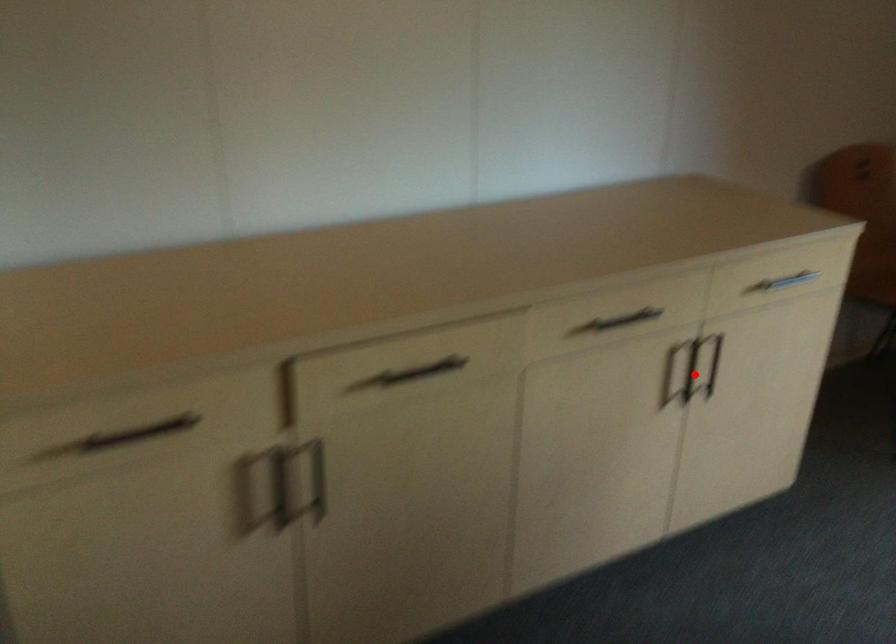
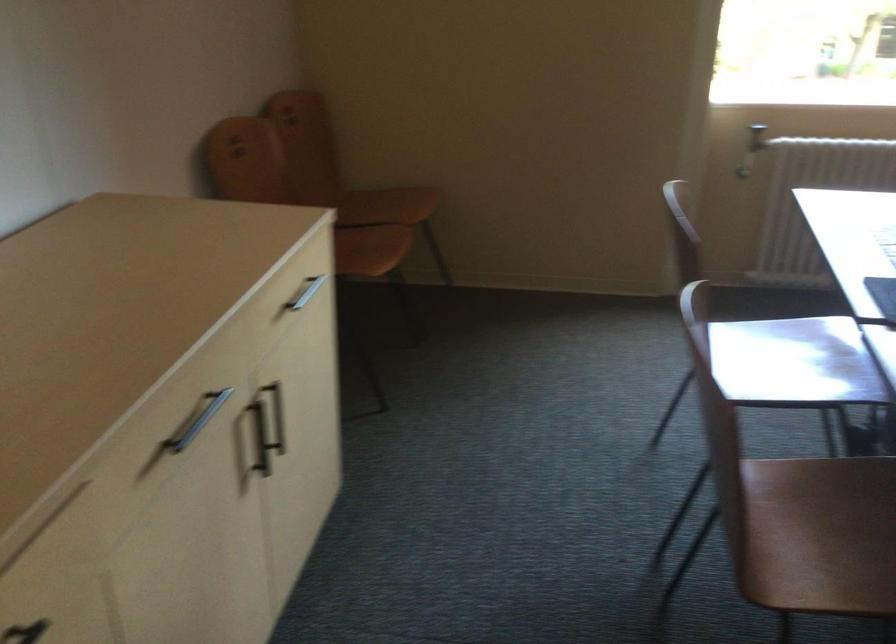
Question: A red point is marked in image1. In image2, is the corresponding 3D point closer to the camera or farther? Reply with the corresponding letter.

Choices:
 (A) The corresponding 3D point is closer.
 (B) The corresponding 3D point is farther.

Answer: (A)